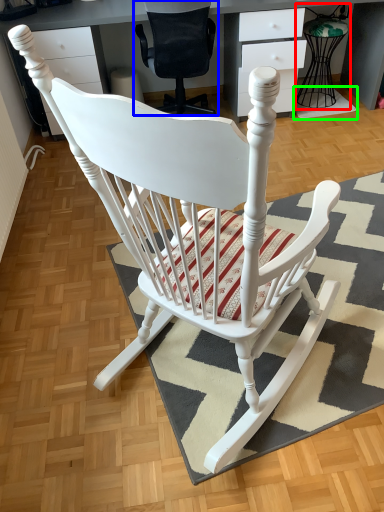
Question: Which object is positioned closest to feeding chair (highlighted by a red box)? Select from chair (highlighted by a blue box) and doormat (highlighted by a green box).

Choices:
 (A) chair
 (B) doormat

Answer: (B)